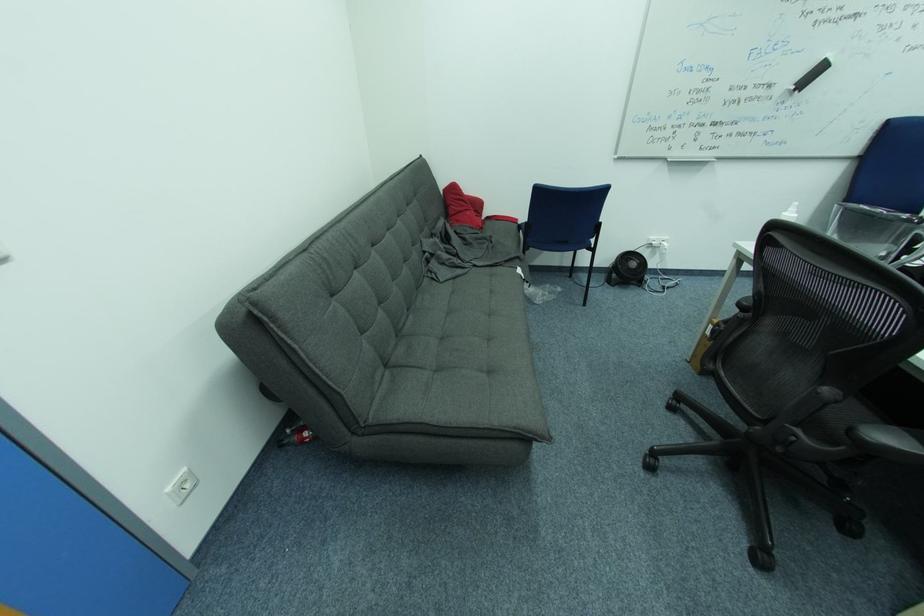
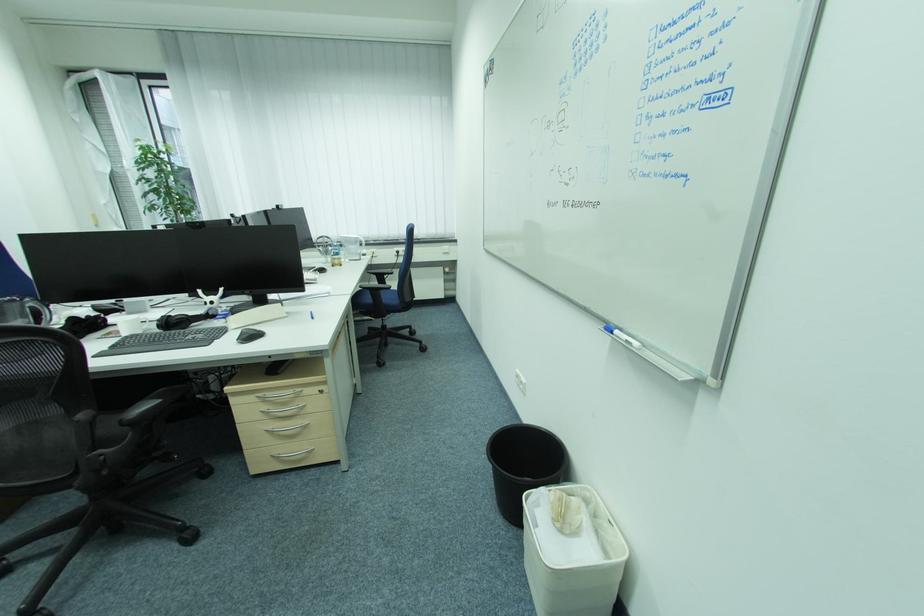
In the second image, find the point that corresponds to (x=804, y=427) in the first image.

(102, 452)